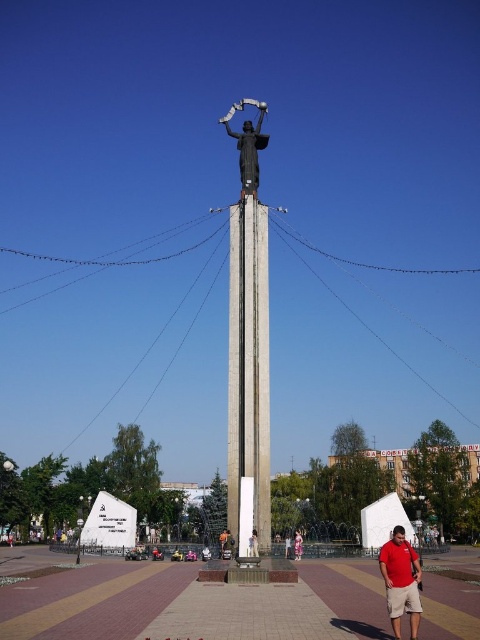
Question: Which of the following is the closest to the observer?

Choices:
 (A) matte white statue at center
 (B) concrete column at center
 (C) matte red shirt at lower right
 (D) orange fabric bag at center

Answer: (C)

Question: Which object is positioned farthest from the matte red shirt at lower right?

Choices:
 (A) matte black statue at center
 (B) orange fabric bag at center
 (C) pink fabric dress at center

Answer: (A)

Question: Considering the relative positions of concrete column at center and matte red shirt at lower right in the image provided, where is concrete column at center located with respect to matte red shirt at lower right?

Choices:
 (A) right
 (B) left

Answer: (B)

Question: Which object is the farthest from the matte red shirt at lower right?

Choices:
 (A) concrete column at center
 (B) pink fabric dress at center

Answer: (B)

Question: Where is orange fabric bag at center located in relation to matte black statue at center in the image?

Choices:
 (A) below
 (B) above

Answer: (B)

Question: Is concrete column at center below matte red shirt at lower right?

Choices:
 (A) yes
 (B) no

Answer: (B)